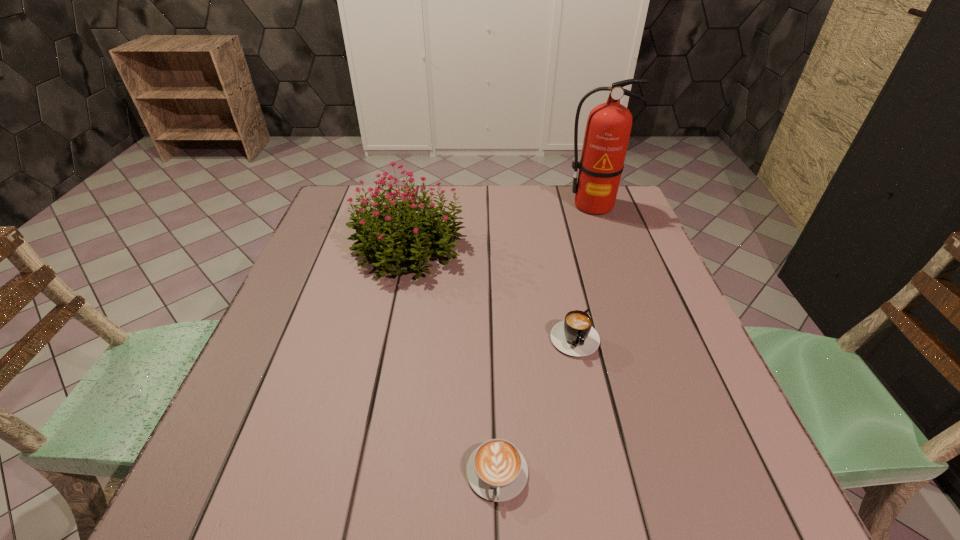
In the image, there is a desktop. At what (x,y) coordinates should I click in order to perform the action: click on free space at the far left corner. Please return your answer as a coordinate pair (x, y). The image size is (960, 540). Looking at the image, I should click on (331, 205).

In the image, there is a desktop. Where is `vacant space at the near left corner`? The image size is (960, 540). vacant space at the near left corner is located at coordinates (280, 483).

At what (x,y) coordinates should I click in order to perform the action: click on vacant area between the third object from right to left and the second tallest object. Please return your answer as a coordinate pair (x, y). The height and width of the screenshot is (540, 960). Looking at the image, I should click on coord(453,360).

The width and height of the screenshot is (960, 540). What are the coordinates of `vacant area that lies between the second tallest object and the fire extinguisher` in the screenshot? It's located at (501, 226).

Find the location of a particular element. This screenshot has height=540, width=960. vacant area that lies between the right cappuccino and the bouquet is located at coordinates (492, 290).

The height and width of the screenshot is (540, 960). Identify the location of unoccupied area between the taller cappuccino and the nearest object. (536, 403).

Identify the location of empty space that is in between the tallest object and the second tallest object. (501, 226).

Locate an element on the screen. free point between the tallest object and the taller cappuccino is located at coordinates (583, 269).

You are a GUI agent. You are given a task and a screenshot of the screen. Output one action in this format:
    pyautogui.click(x=<x>, y=<y>)
    Task: Click on the blank region between the taller cappuccino and the fire extinguisher
    This screenshot has width=960, height=540.
    Given the screenshot: What is the action you would take?
    pyautogui.click(x=583, y=269)

This screenshot has width=960, height=540. I want to click on vacant area between the left cappuccino and the fire extinguisher, so click(x=545, y=339).